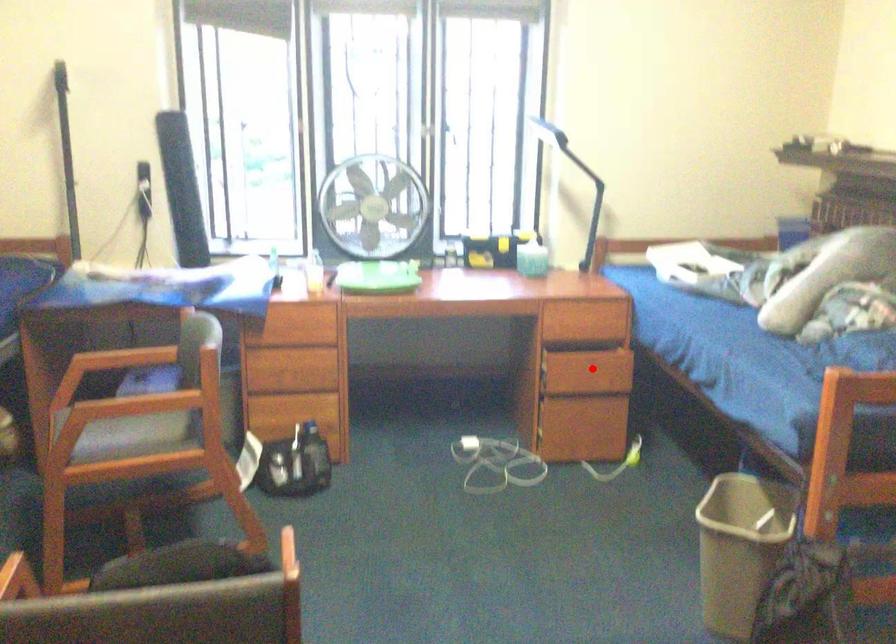
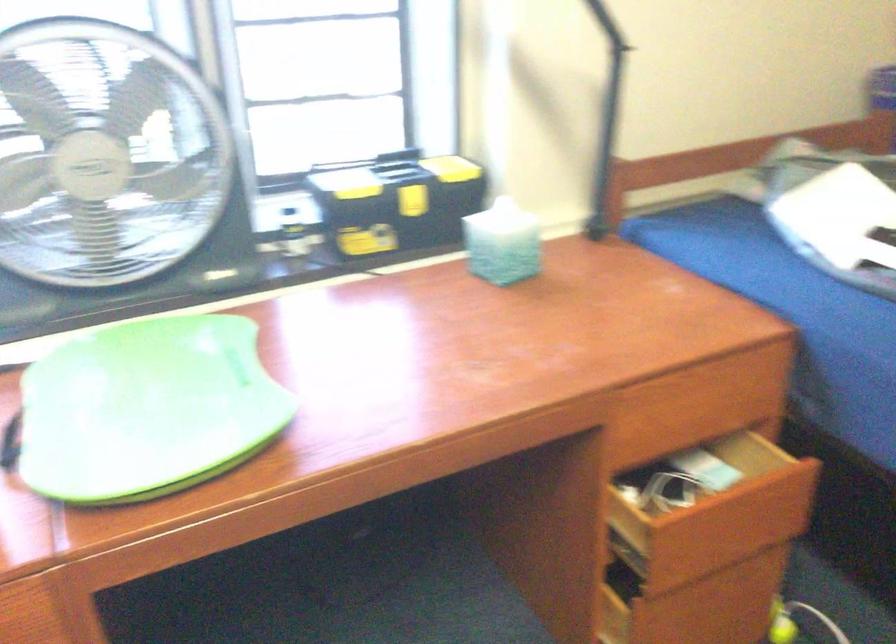
Where in the second image is the point corresponding to the highlighted location from the first image?

(721, 526)